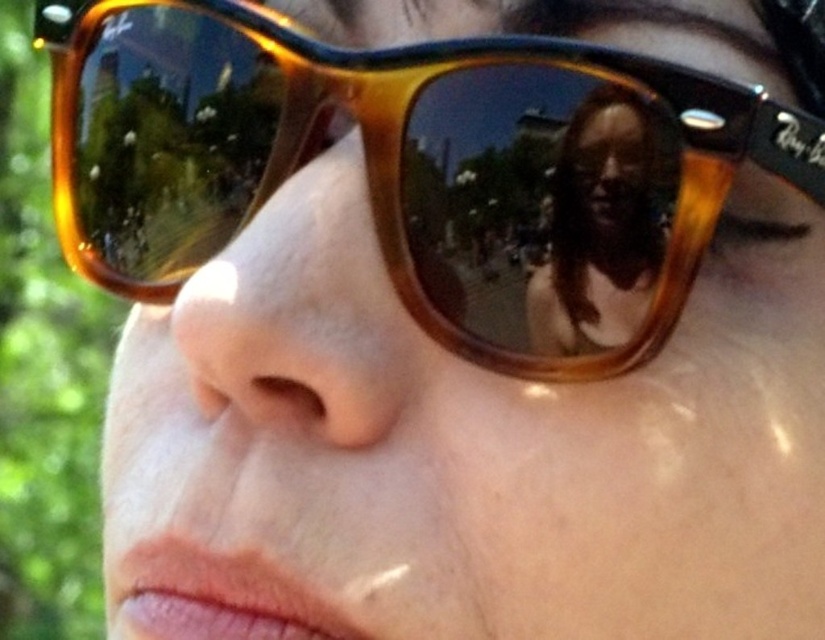
Which of these two, tortoiseshell sunglasses at center or matte brown hair at center, stands taller?

tortoiseshell sunglasses at center

The image size is (825, 640). What are the coordinates of `tortoiseshell sunglasses at center` in the screenshot? It's located at (412, 168).

Where is `tortoiseshell sunglasses at center`? The height and width of the screenshot is (640, 825). tortoiseshell sunglasses at center is located at coordinates (412, 168).

I want to click on tortoiseshell sunglasses at center, so point(412,168).